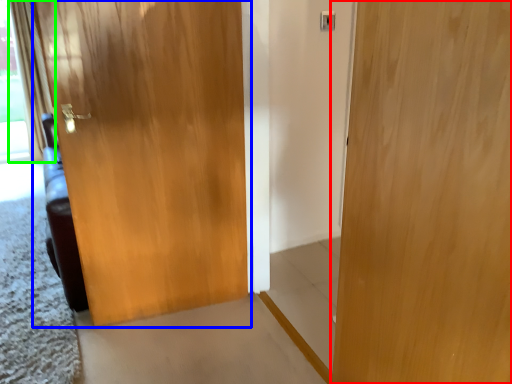
Question: Based on their relative distances, which object is farther from door (highlighted by a red box)? Choose from door (highlighted by a blue box) and curtain (highlighted by a green box).

Choices:
 (A) door
 (B) curtain

Answer: (B)